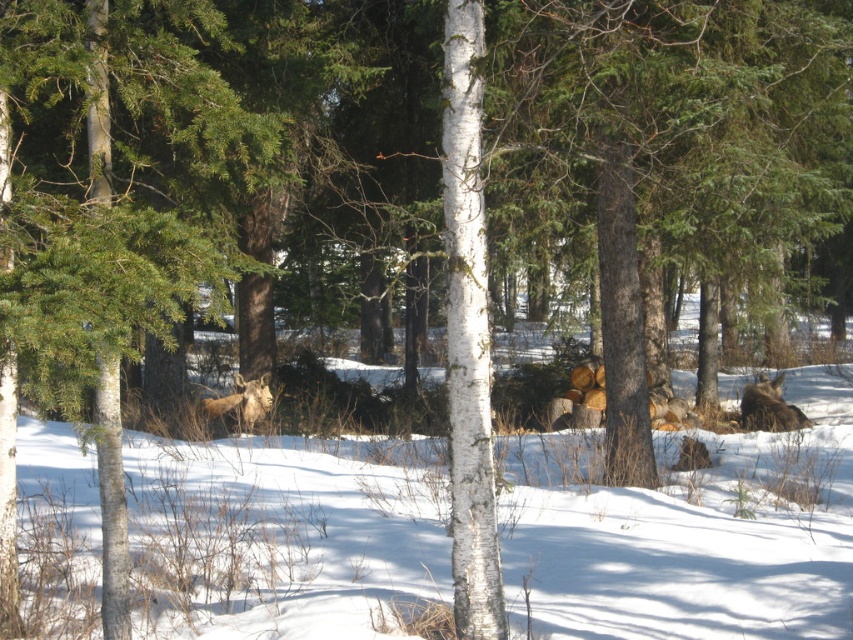
Does point (495, 602) come behind point (221, 410)?

That is False.

Who is more distant from viewer, (469, 593) or (213, 401)?

Point (213, 401)

Identify the location of white smooth birch tree at center. (468, 333).

The width and height of the screenshot is (853, 640). Describe the element at coordinates (769, 406) in the screenshot. I see `brown fur animal at lower right` at that location.

Find the location of a particular element. Image resolution: width=853 pixels, height=640 pixels. brown fur animal at lower right is located at coordinates (769, 406).

Does point (755, 390) come in front of point (267, 404)?

No, it is behind (267, 404).

Identify the location of brown fur animal at lower right. The width and height of the screenshot is (853, 640). (769, 406).

Can you confirm if green matte tree at left is positioned below brown fur animal at lower right?

No, green matte tree at left is not below brown fur animal at lower right.

Does green matte tree at left have a lesser height compared to brown fur animal at lower right?

Incorrect, green matte tree at left's height does not fall short of brown fur animal at lower right's.

Does point (1, 253) come in front of point (744, 422)?

Yes, it is.

At what (x,y) coordinates should I click in order to perform the action: click on green matte tree at left. Please return your answer as a coordinate pair (x, y). Looking at the image, I should click on (103, 225).